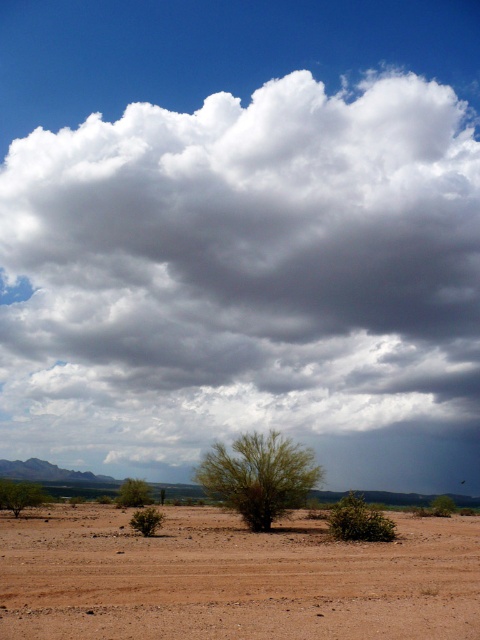
You are a desert explorer who needs to cross the brown sandy dirt field at lower center and the green leafy bush at lower right. Which of these two objects is shorter?

The brown sandy dirt field at lower center is shorter than the green leafy bush at lower right.

You are a desert explorer and need to cross from the brown sandy dirt field at lower center to the green leafy bush at lower right. Which path is wider for your vehicle? Please explain using the objects mentioned.

The brown sandy dirt field at lower center is wider than the green leafy bush at lower right, so the path through the brown sandy dirt field at lower center is wider for your vehicle.